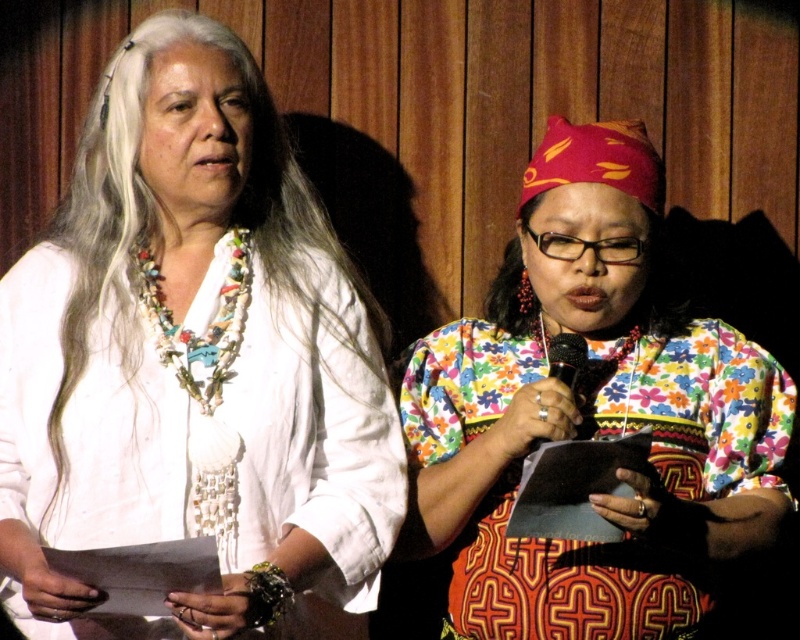
You are a photographer adjusting the camera settings to capture a clear photo of both the white beaded necklace at center and the floral fabric dress at center. Given that the camera has a maximum focus range of 12 inches, will you need to adjust the camera position to ensure both items are in focus?

The white beaded necklace at center and floral fabric dress at center are 12.67 inches apart. Since the distance between them exceeds the camera maximum focus range of 12 inches, you need to adjust the camera position to ensure both items are in focus.

In the scene shown: You are taking a photo of the two individuals in the scene. The multicolored beaded necklace at left is positioned at coordinates 0.602 on the x and 0.258 on the y. If your camera focuses on the center of the image, will the necklace be in focus?

The multicolored beaded necklace at left is located at point (206, 385). Since the camera focuses on the center of the image, the necklace is not at the center coordinates, so it may not be in focus unless the depth of field is wide enough to include that position.

You are taking a photo of the two people in the image. The camera is set to focus on the white beaded necklace at center. Where should you aim the camera to capture the necklace in focus?

You should aim the camera at point 0.559 on the x axis and point 0.241 on the y axis to capture the white beaded necklace at center in focus.